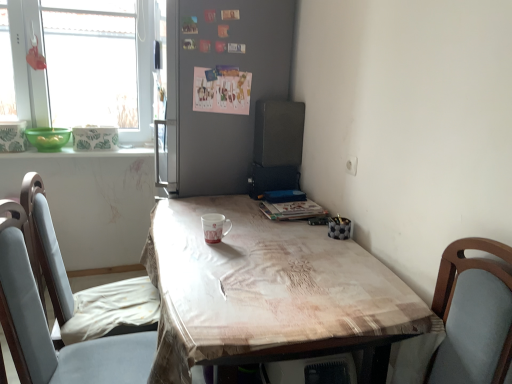
Question: Considering the relative sizes of black matte speaker at upper right and white glossy mug at center in the image provided, is black matte speaker at upper right thinner than white glossy mug at center?

Choices:
 (A) yes
 (B) no

Answer: (B)

Question: From the image's perspective, is black matte speaker at upper right below white glossy mug at center?

Choices:
 (A) no
 (B) yes

Answer: (A)

Question: Can you confirm if black matte speaker at upper right is positioned to the right of white glossy mug at center?

Choices:
 (A) yes
 (B) no

Answer: (A)

Question: Is black matte speaker at upper right in contact with white glossy mug at center?

Choices:
 (A) yes
 (B) no

Answer: (B)

Question: Would you say black matte speaker at upper right contains white glossy mug at center?

Choices:
 (A) yes
 (B) no

Answer: (B)

Question: Looking at their shapes, would you say green matte bowl at left is wider or thinner than light brown fabric table at center?

Choices:
 (A) wide
 (B) thin

Answer: (B)

Question: Visually, is green matte bowl at left positioned to the left or to the right of light brown fabric table at center?

Choices:
 (A) right
 (B) left

Answer: (B)

Question: From a real-world perspective, is green matte bowl at left physically located above or below light brown fabric table at center?

Choices:
 (A) below
 (B) above

Answer: (B)

Question: In the image, is green matte bowl at left positioned in front of or behind light brown fabric table at center?

Choices:
 (A) front
 (B) behind

Answer: (B)

Question: Considering the positions of black matte speaker at upper right and white glossy mug at center in the image, is black matte speaker at upper right bigger or smaller than white glossy mug at center?

Choices:
 (A) small
 (B) big

Answer: (B)

Question: Is black matte speaker at upper right in front of or behind white glossy mug at center in the image?

Choices:
 (A) behind
 (B) front

Answer: (A)

Question: In the image, is black matte speaker at upper right on the left side or the right side of white glossy mug at center?

Choices:
 (A) right
 (B) left

Answer: (A)

Question: Which is correct: black matte speaker at upper right is inside white glossy mug at center, or outside of it?

Choices:
 (A) inside
 (B) outside

Answer: (B)

Question: Is transparent glass window at upper left spatially inside green glossy bowls at left, or outside of it?

Choices:
 (A) inside
 (B) outside

Answer: (B)

Question: In terms of height, does transparent glass window at upper left look taller or shorter compared to green glossy bowls at left?

Choices:
 (A) tall
 (B) short

Answer: (A)